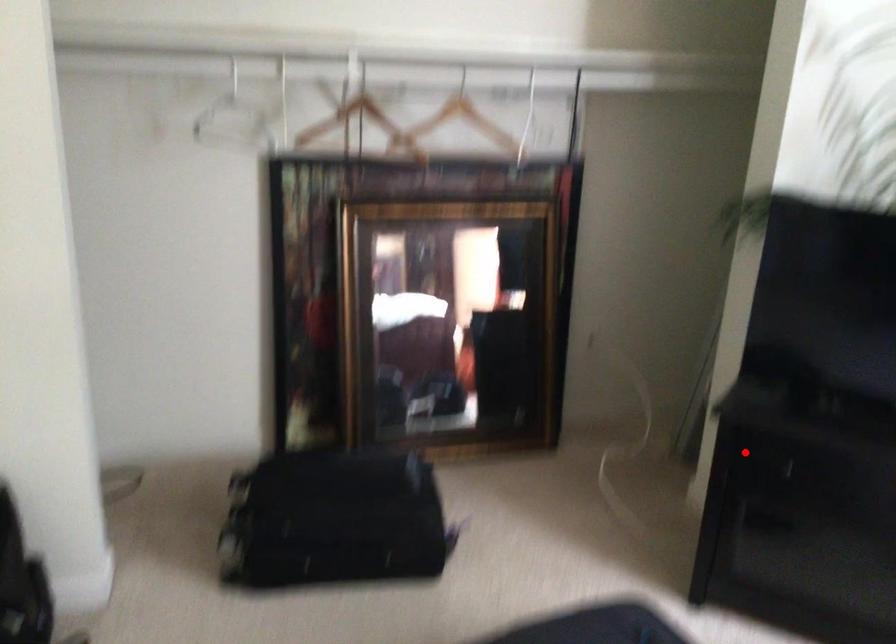
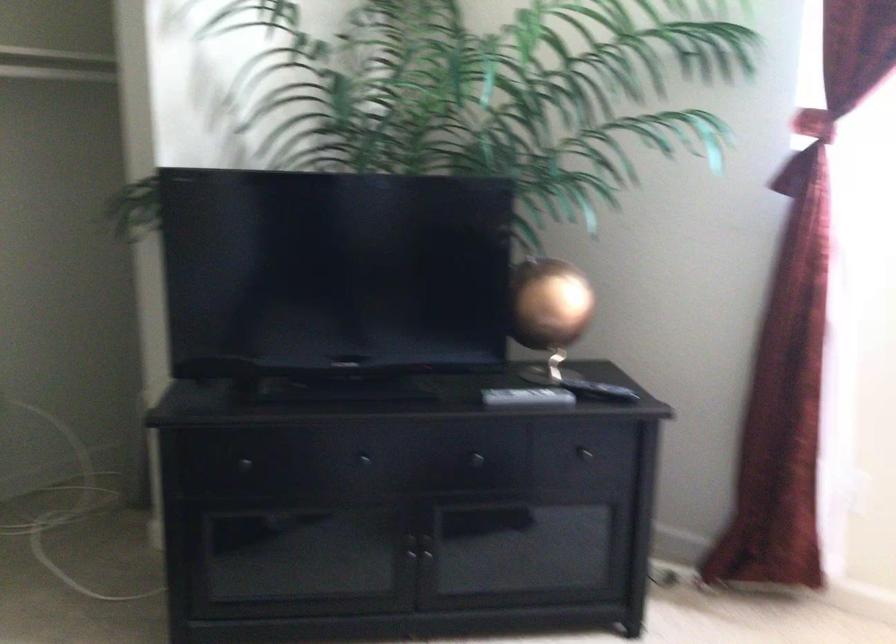
Question: I am providing you with two images of the same scene from different viewpoints. Image1 has a red point marked. In image2, the corresponding 3D location appears at what relative position? Reply with the corresponding letter.

Choices:
 (A) Closer
 (B) Farther

Answer: (A)